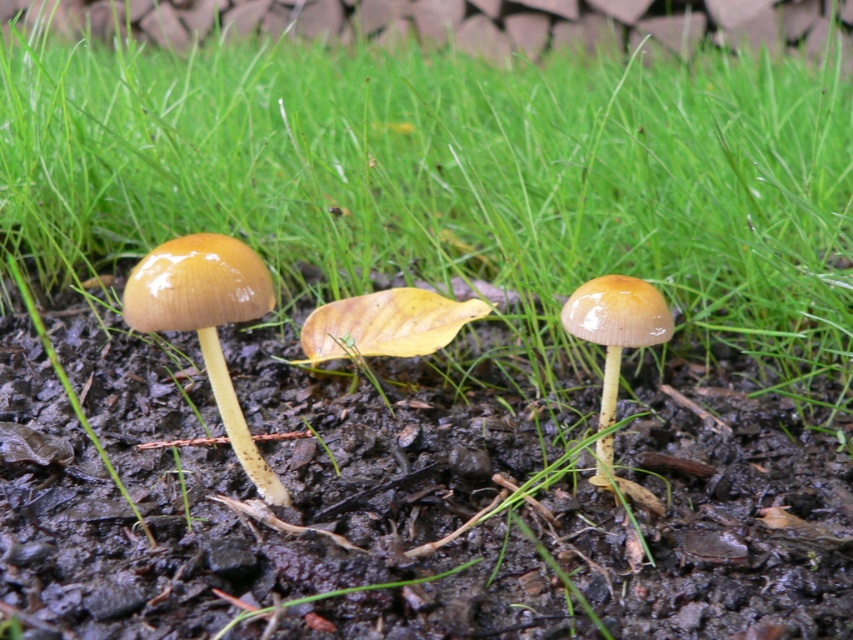
Question: In this image, where is glossy yellow mushroom at left located relative to glossy yellow mushroom at center?

Choices:
 (A) above
 (B) below

Answer: (B)

Question: Which point is farther to the camera?

Choices:
 (A) (584, 300)
 (B) (213, 348)

Answer: (A)

Question: Which of the following is the closest to the observer?

Choices:
 (A) glossy yellow mushroom at center
 (B) glossy yellow mushroom at left

Answer: (B)

Question: Is glossy yellow mushroom at left positioned at the back of glossy yellow mushroom at center?

Choices:
 (A) no
 (B) yes

Answer: (A)

Question: Which of the following is the farthest from the observer?

Choices:
 (A) (608, 284)
 (B) (277, 480)

Answer: (B)

Question: Does glossy yellow mushroom at left appear on the left side of glossy yellow mushroom at center?

Choices:
 (A) no
 (B) yes

Answer: (B)